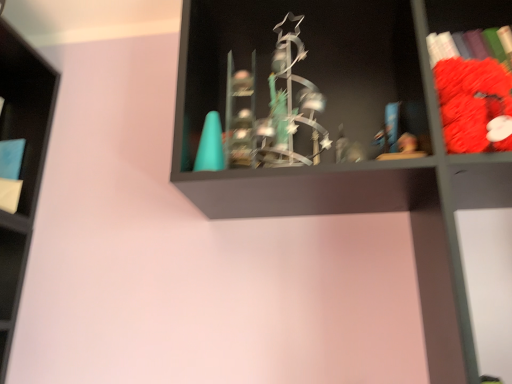
Question: Is velvet red plush toy at right, the 1th book positioned from the front, completely or partially outside of metallic statue at center?

Choices:
 (A) yes
 (B) no

Answer: (B)

Question: Can you confirm if velvet red plush toy at right, the 1th book positioned from the front, is taller than metallic statue at center?

Choices:
 (A) yes
 (B) no

Answer: (B)

Question: Is velvet red plush toy at right, acting as the first book starting from the right, to the left of metallic statue at center from the viewer's perspective?

Choices:
 (A) yes
 (B) no

Answer: (B)

Question: From a real-world perspective, does velvet red plush toy at right, acting as the first book starting from the right, sit lower than metallic statue at center?

Choices:
 (A) yes
 (B) no

Answer: (B)

Question: From a real-world perspective, is velvet red plush toy at right, placed as the second book when sorted from left to right, physically above metallic statue at center?

Choices:
 (A) no
 (B) yes

Answer: (B)

Question: From a real-world perspective, is velvet red plush toy at right, acting as the second book starting from the back, physically located above or below metallic statue at center?

Choices:
 (A) below
 (B) above

Answer: (B)

Question: In the image, is velvet red plush toy at right, acting as the first book starting from the right, on the left side or the right side of metallic statue at center?

Choices:
 (A) left
 (B) right

Answer: (B)

Question: In terms of size, does velvet red plush toy at right, the 1th book positioned from the front, appear bigger or smaller than metallic statue at center?

Choices:
 (A) small
 (B) big

Answer: (A)

Question: From the image's perspective, is velvet red plush toy at right, placed as the second book when sorted from left to right, located above or below metallic statue at center?

Choices:
 (A) above
 (B) below

Answer: (A)

Question: From their relative heights in the image, would you say metallic statue at center is taller or shorter than blue matte book at left, which is the 2th book in right-to-left order?

Choices:
 (A) short
 (B) tall

Answer: (B)

Question: From a real-world perspective, is metallic statue at center positioned above or below blue matte book at left, positioned as the 1th book in back-to-front order?

Choices:
 (A) below
 (B) above

Answer: (A)

Question: Is metallic statue at center to the left or to the right of blue matte book at left, which is counted as the second book, starting from the front, in the image?

Choices:
 (A) left
 (B) right

Answer: (B)

Question: Is metallic statue at center inside or outside of blue matte book at left, which is the 2th book in right-to-left order?

Choices:
 (A) inside
 (B) outside

Answer: (B)

Question: Considering the positions of point (15, 196) and point (494, 92), is point (15, 196) closer or farther from the camera than point (494, 92)?

Choices:
 (A) closer
 (B) farther

Answer: (B)

Question: Would you say blue matte book at left, placed as the 1th book when sorted from left to right, is inside or outside velvet red plush toy at right, the 1th book positioned from the front?

Choices:
 (A) outside
 (B) inside

Answer: (A)